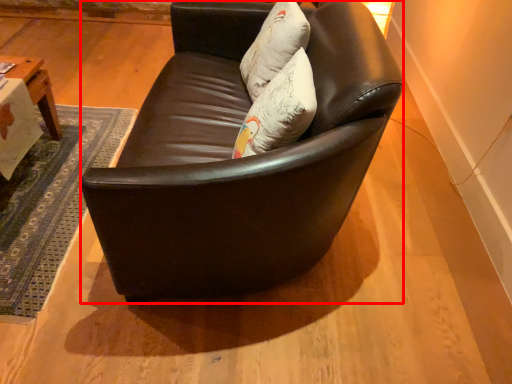
Question: From the image's perspective, considering the relative positions of studio couch (annotated by the red box) and pillow in the image provided, where is studio couch (annotated by the red box) located with respect to the staircase?

Choices:
 (A) above
 (B) below

Answer: (B)